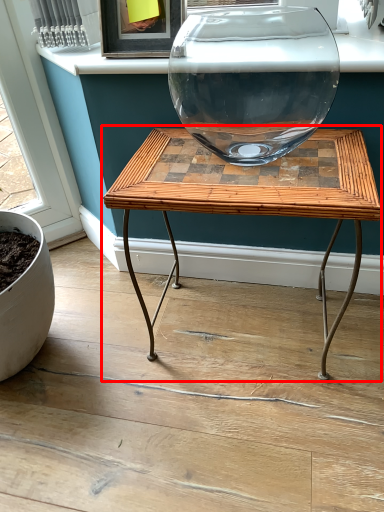
Question: From the image's perspective, where is table (annotated by the red box) located in relation to window sill in the image?

Choices:
 (A) above
 (B) below

Answer: (B)